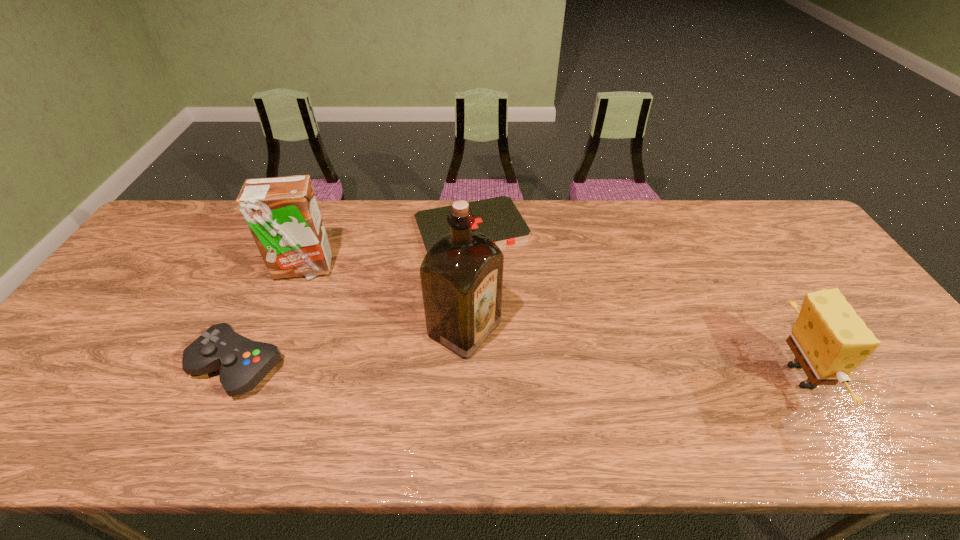
At what (x,y) coordinates should I click in order to perform the action: click on vacant space located 0.060m on the straw side of the carton. Please return your answer as a coordinate pair (x, y). Looking at the image, I should click on (335, 287).

Find the location of a particular element. This screenshot has height=540, width=960. vacant area located 0.200m on the label of the tallest object is located at coordinates (566, 388).

Where is `blank space located 0.170m on the label of the tallest object`? Image resolution: width=960 pixels, height=540 pixels. blank space located 0.170m on the label of the tallest object is located at coordinates (555, 381).

Identify the location of vacant space situated 0.240m on the label of the tallest object. This screenshot has height=540, width=960. click(x=582, y=396).

At what (x,y) coordinates should I click in order to perform the action: click on free location located 0.080m on handle side the shortest object. Please return your answer as a coordinate pair (x, y). Looking at the image, I should click on (498, 276).

Identify the location of free space located on handle side the shortest object. (495, 271).

Where is `free space located on handle side the shortest object`? This screenshot has width=960, height=540. free space located on handle side the shortest object is located at coordinates (516, 313).

Identify the location of object that is at the far edge. The image size is (960, 540). (498, 218).

Locate an element on the screen. control located in the near edge section of the desktop is located at coordinates (243, 363).

You are a GUI agent. You are given a task and a screenshot of the screen. Output one action in this format:
    pyautogui.click(x=<x>, y=<y>)
    Task: Click on the sponge that is at the near edge
    
    Given the screenshot: What is the action you would take?
    pyautogui.click(x=829, y=340)